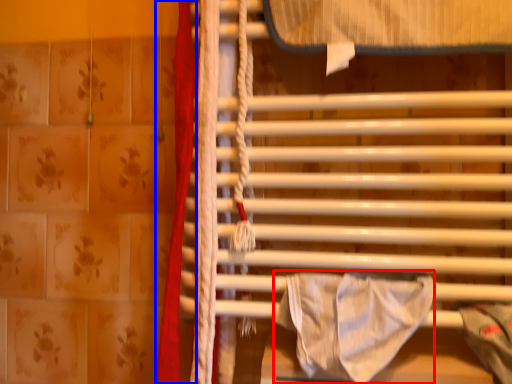
Question: Which of the following is the closest to the observer, blanket (highlighted by a red box) or curtain (highlighted by a blue box)?

Choices:
 (A) blanket
 (B) curtain

Answer: (A)